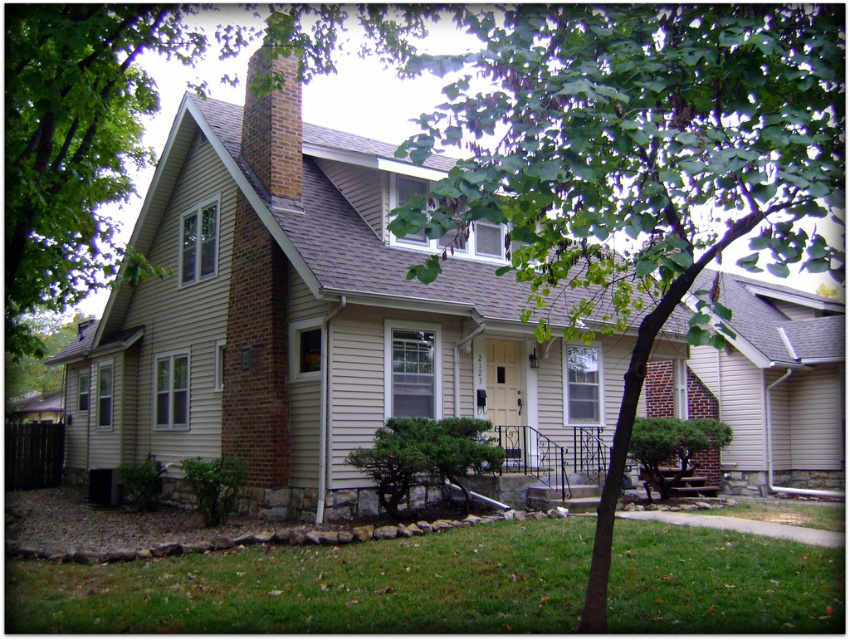
Question: Which object is farther from the camera taking this photo?

Choices:
 (A) green grass at lower left
 (B) green leafy tree at center

Answer: (A)

Question: Can you confirm if green leafy tree at center is bigger than green grass at lower left?

Choices:
 (A) no
 (B) yes

Answer: (B)

Question: Does green leafy tree at center appear under green grass at lower left?

Choices:
 (A) yes
 (B) no

Answer: (B)

Question: Is green leafy tree at center smaller than green grass at lower left?

Choices:
 (A) no
 (B) yes

Answer: (A)

Question: Which object appears closest to the camera in this image?

Choices:
 (A) green leafy tree at center
 (B) green grass at lower left

Answer: (A)